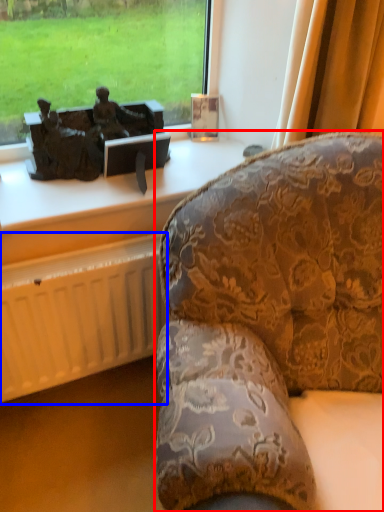
Question: Which point is further to the camera, studio couch (highlighted by a red box) or radiator (highlighted by a blue box)?

Choices:
 (A) studio couch
 (B) radiator

Answer: (B)